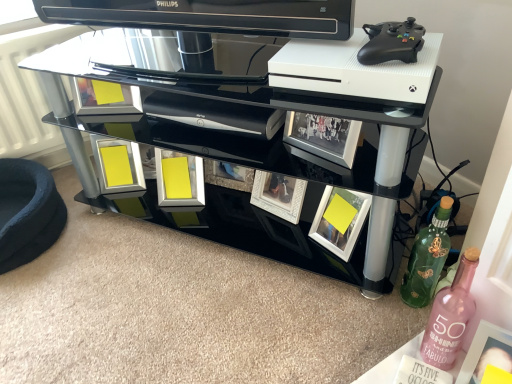
Locate an element on the screen. vacant space in between metallic yellow picture frame at lower left, which ranks as the 1th picture frame in back-to-front order, and velvet cushion at lower left is located at coordinates (96, 212).